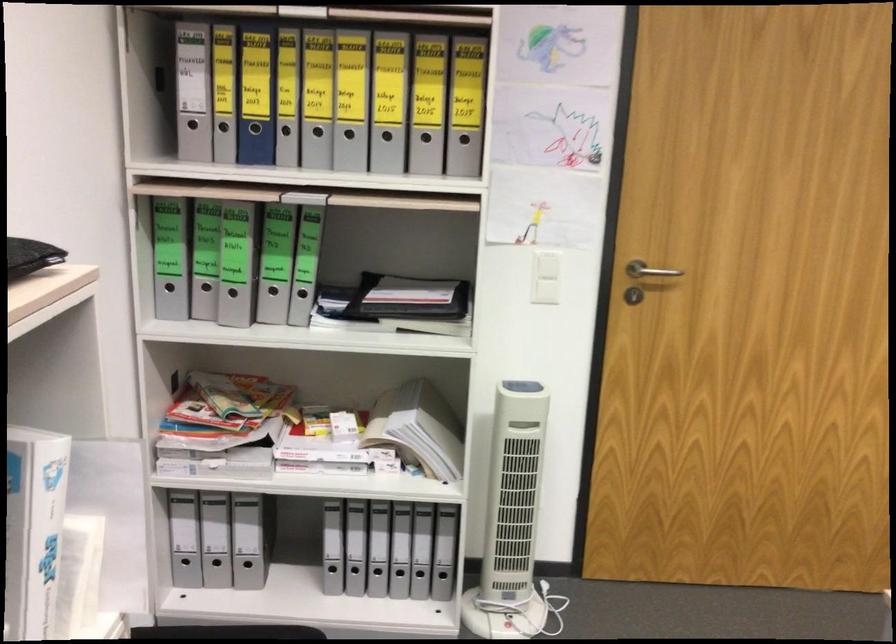
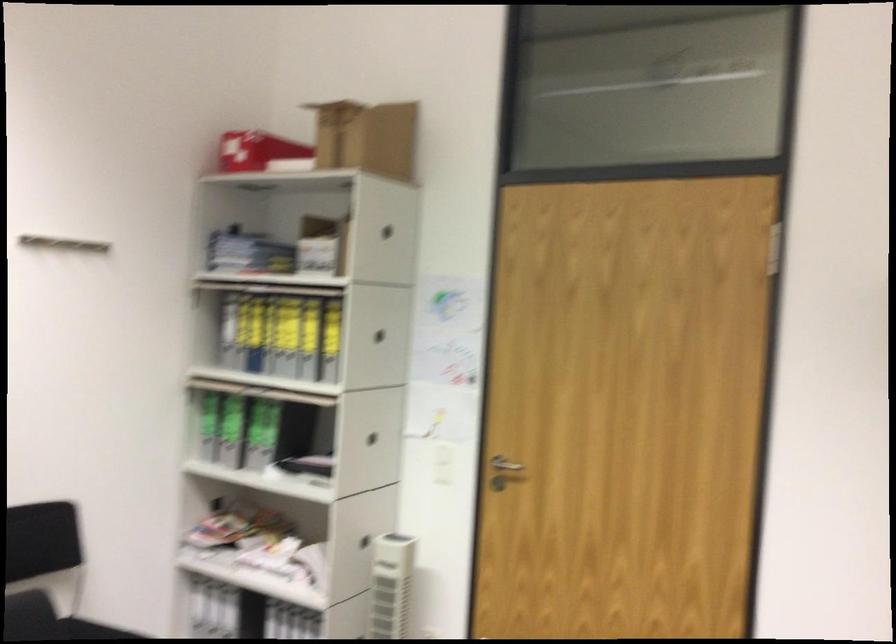
The point at (x=419, y=140) is marked in the first image. Where is the corresponding point in the second image?

(330, 359)